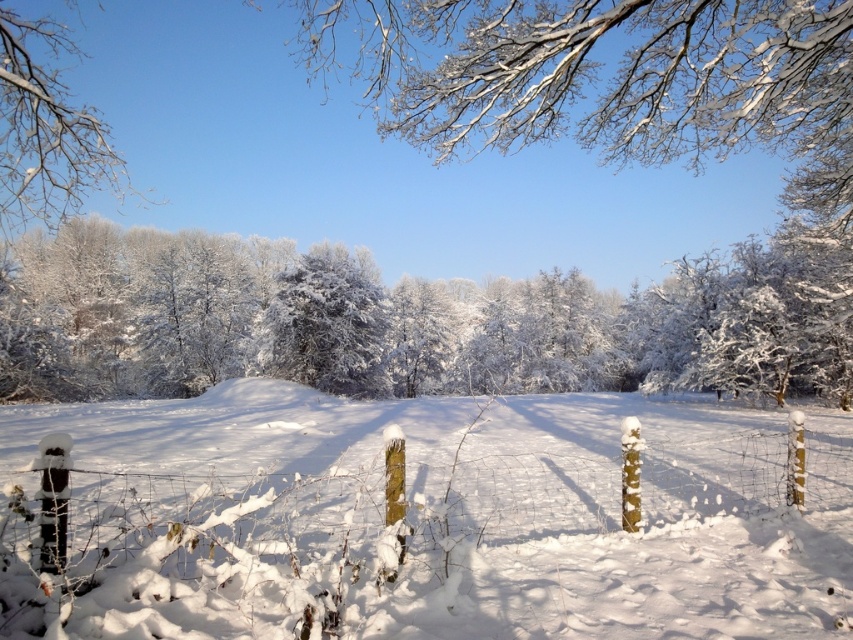
Can you confirm if snow-covered wooden posts at center is bigger than white frosty branches at upper left?

Actually, snow-covered wooden posts at center might be smaller than white frosty branches at upper left.

Between snow-covered wooden posts at center and white frosty branches at upper left, which one is positioned higher?

white frosty branches at upper left is above.

Does point (380, 419) come in front of point (38, 116)?

No, (380, 419) is behind (38, 116).

What are the coordinates of `snow-covered wooden posts at center` in the screenshot? It's located at point(431,502).

What do you see at coordinates (410, 321) in the screenshot?
I see `white frosty trees at center` at bounding box center [410, 321].

Describe the element at coordinates (410, 321) in the screenshot. I see `white frosty trees at center` at that location.

Find the location of a particular element. The image size is (853, 640). white frosty trees at center is located at coordinates (410, 321).

Can you confirm if snow-covered wooden posts at center is positioned to the left of white frosty trees at center?

No, snow-covered wooden posts at center is not to the left of white frosty trees at center.

Is snow-covered wooden posts at center shorter than white frosty trees at center?

Yes.

The height and width of the screenshot is (640, 853). I want to click on snow-covered wooden posts at center, so click(431, 502).

This screenshot has width=853, height=640. Identify the location of snow-covered wooden posts at center. (431, 502).